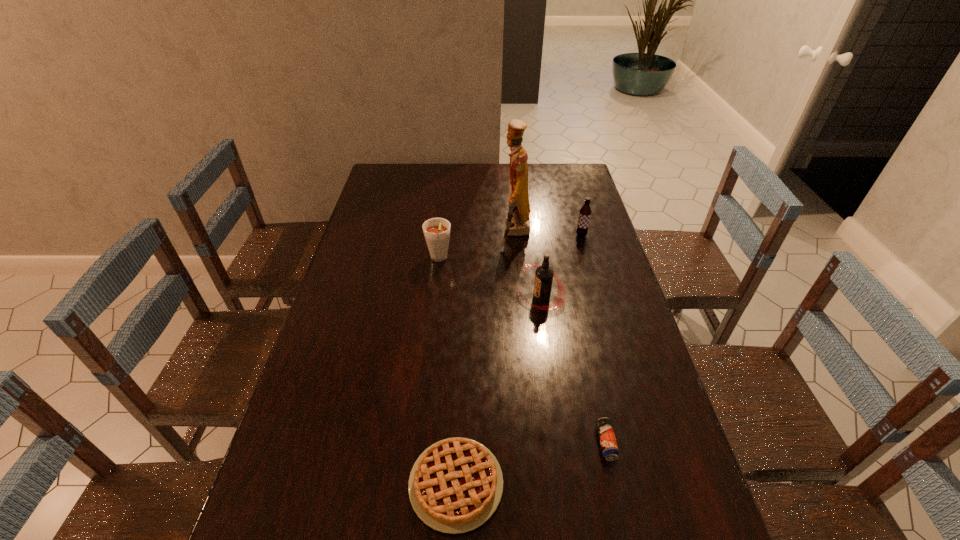
Identify the location of vacant space located 0.320m on the front-facing side of the tallest object. This screenshot has height=540, width=960. (412, 234).

I want to click on blank space located on the label of the nearest root beer, so click(x=449, y=297).

This screenshot has height=540, width=960. Find the location of `free space located 0.280m on the label of the nearest root beer`. free space located 0.280m on the label of the nearest root beer is located at coordinates (426, 297).

The height and width of the screenshot is (540, 960). I want to click on blank area located 0.300m on the label of the nearest root beer, so click(420, 297).

This screenshot has width=960, height=540. I want to click on free space located on the drink side of the second nearest root beer, so tap(431, 328).

Identify the location of vacant space situated on the front of the farthest root beer. (594, 282).

The image size is (960, 540). Find the location of `vacant area situated on the back of the pie`. vacant area situated on the back of the pie is located at coordinates (461, 366).

You are a GUI agent. You are given a task and a screenshot of the screen. Output one action in this format:
    pyautogui.click(x=<x>, y=<y>)
    Task: Click on the vacant space positioned on the back of the second object from right to left
    The image size is (960, 540).
    Given the screenshot: What is the action you would take?
    coord(585,346)

Where is `root beer positioned at the right edge`? This screenshot has width=960, height=540. root beer positioned at the right edge is located at coordinates [585, 212].

Where is `beer can that is at the right edge`? The width and height of the screenshot is (960, 540). beer can that is at the right edge is located at coordinates (609, 447).